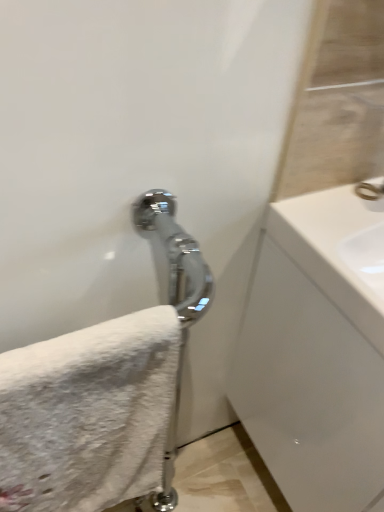
Question: Are polished chrome faucet at upper right and white glossy sink at right far apart?

Choices:
 (A) no
 (B) yes

Answer: (A)

Question: Is polished chrome faucet at upper right shorter than white glossy sink at right?

Choices:
 (A) yes
 (B) no

Answer: (A)

Question: Is polished chrome faucet at upper right wider than white glossy sink at right?

Choices:
 (A) no
 (B) yes

Answer: (A)

Question: Considering the relative sizes of polished chrome faucet at upper right and white glossy sink at right in the image provided, is polished chrome faucet at upper right taller than white glossy sink at right?

Choices:
 (A) no
 (B) yes

Answer: (A)

Question: Is polished chrome faucet at upper right closer to camera compared to white glossy sink at right?

Choices:
 (A) no
 (B) yes

Answer: (A)

Question: From the image's perspective, is white glossy sink at right positioned above or below polished chrome faucet at upper right?

Choices:
 (A) above
 (B) below

Answer: (B)

Question: Do you think white glossy sink at right is within polished chrome faucet at upper right, or outside of it?

Choices:
 (A) inside
 (B) outside

Answer: (B)

Question: Is point (288, 354) positioned closer to the camera than point (367, 189)?

Choices:
 (A) farther
 (B) closer

Answer: (A)

Question: Looking at their shapes, would you say white glossy sink at right is wider or thinner than polished chrome faucet at upper right?

Choices:
 (A) wide
 (B) thin

Answer: (A)

Question: Does point (172, 395) appear closer or farther from the camera than point (367, 192)?

Choices:
 (A) farther
 (B) closer

Answer: (B)

Question: Considering the relative positions of white fluffy towel at lower left and polished chrome faucet at upper right in the image provided, is white fluffy towel at lower left to the left or to the right of polished chrome faucet at upper right?

Choices:
 (A) left
 (B) right

Answer: (A)

Question: From a real-world perspective, is white fluffy towel at lower left positioned above or below polished chrome faucet at upper right?

Choices:
 (A) below
 (B) above

Answer: (A)

Question: Which is correct: white fluffy towel at lower left is inside polished chrome faucet at upper right, or outside of it?

Choices:
 (A) outside
 (B) inside

Answer: (A)

Question: From a real-world perspective, is white glossy sink at right positioned above or below white fluffy towel at lower left?

Choices:
 (A) above
 (B) below

Answer: (B)

Question: Considering the positions of white glossy sink at right and white fluffy towel at lower left in the image, is white glossy sink at right wider or thinner than white fluffy towel at lower left?

Choices:
 (A) thin
 (B) wide

Answer: (B)